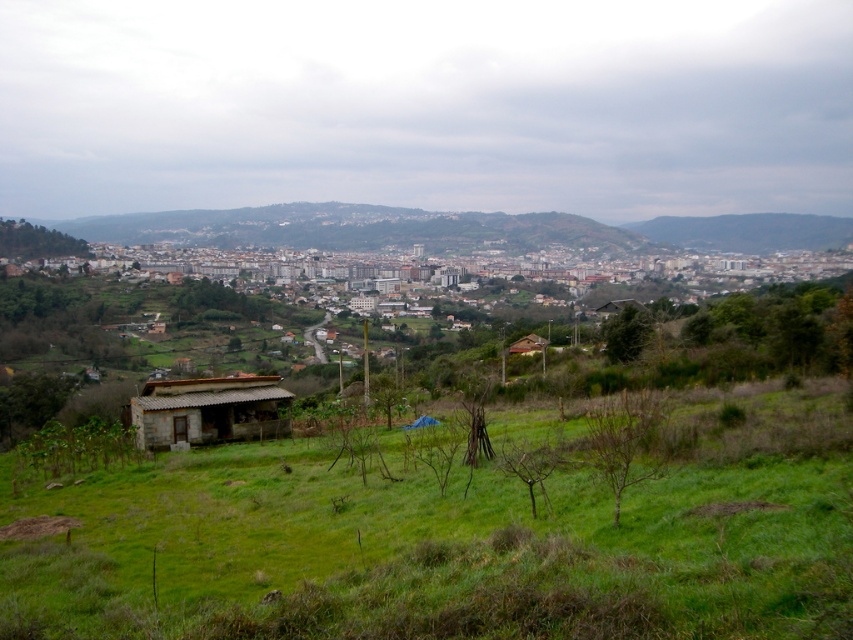
Looking at this image, you are standing at the point with coordinates point (x=213, y=566) and want to walk towards the point with coordinates point (x=537, y=339). Which direction should you move relative to your current position?

Since point (x=213, y=566) is in front of point (x=537, y=339), you should move backward to reach it.

You are a delivery drone with a maximum flight range of 50 feet. You need to deliver a package from the green grassy field at lower center to the rustic stone hut at lower left. Can you complete the delivery without needing to recharge?

The distance between the green grassy field at lower center and the rustic stone hut at lower left is 56.11 feet, which exceeds the drone s 50 feet maximum flight range. Therefore, the drone cannot complete the delivery without recharging.